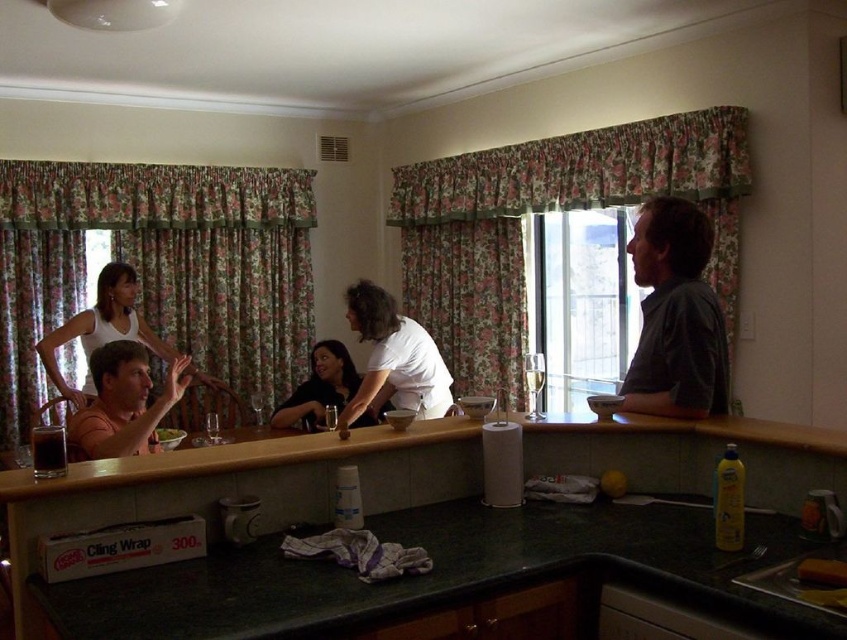
Question: Which object is farther from the camera taking this photo?

Choices:
 (A) smooth yellow sponge at lower right
 (B) yellow matte apple at center
 (C) white fabric shirt at upper left

Answer: (C)

Question: Does green marble countertop at center appear on the left side of matte orange tank top at left?

Choices:
 (A) yes
 (B) no

Answer: (B)

Question: Observing the image, what is the correct spatial positioning of matte black shirt at center in reference to black plastic sink at lower right?

Choices:
 (A) below
 (B) above

Answer: (B)

Question: Which object is positioned closest to the matte orange tank top at left?

Choices:
 (A) matte black shirt at center
 (B) white fabric shirt at upper left

Answer: (A)

Question: Which object appears farthest from the camera in this image?

Choices:
 (A) green marble countertop at center
 (B) white fabric shirt at upper left

Answer: (B)

Question: Does white fabric shirt at upper left appear under black plastic sink at lower right?

Choices:
 (A) yes
 (B) no

Answer: (B)